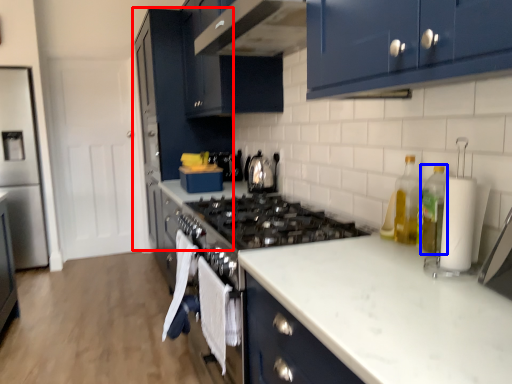
Question: Which object is further to the camera taking this photo, cabinetry (highlighted by a red box) or bottle (highlighted by a blue box)?

Choices:
 (A) cabinetry
 (B) bottle

Answer: (A)